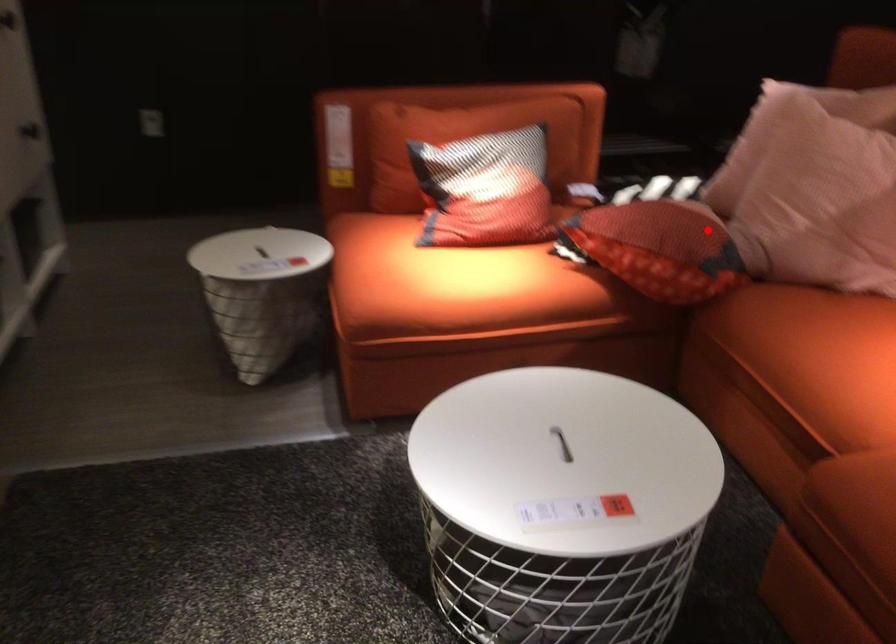
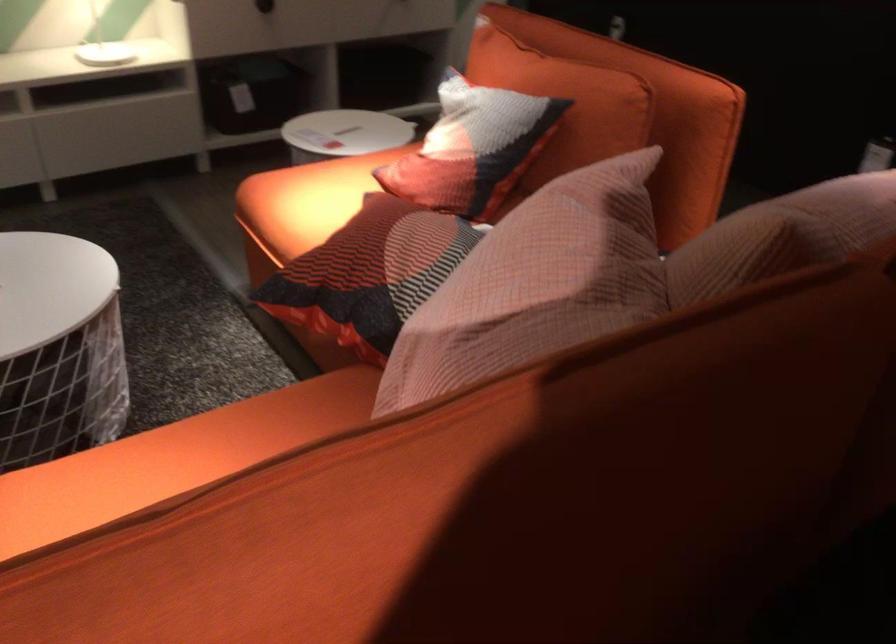
Where in the second image is the point corresponding to the highlighted location from the first image?

(369, 274)